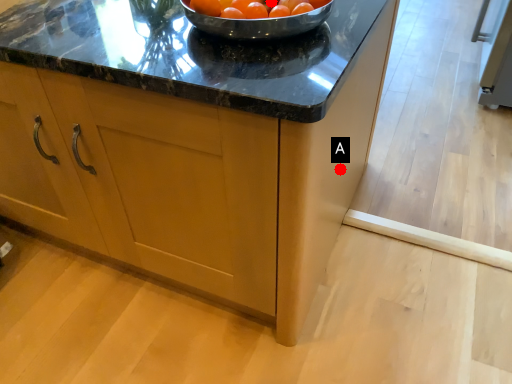
Question: Two points are circled on the image, labeled by A and B beside each circle. Which point appears farthest from the camera in this image?

Choices:
 (A) A is further
 (B) B is further

Answer: (A)